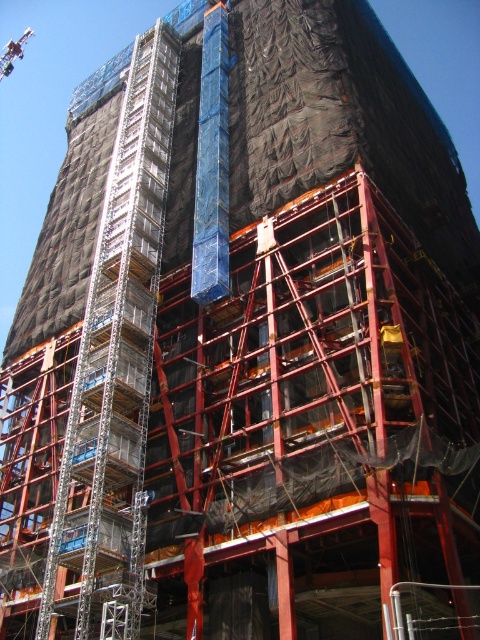
Question: Does metallic scaffolding at left appear on the right side of metallic red crane at upper left?

Choices:
 (A) yes
 (B) no

Answer: (A)

Question: Does metallic scaffolding at left appear on the right side of metallic red crane at upper left?

Choices:
 (A) yes
 (B) no

Answer: (A)

Question: Among these points, which one is farthest from the camera?

Choices:
 (A) (20, 44)
 (B) (148, 340)

Answer: (A)

Question: Can you confirm if metallic scaffolding at left is positioned below metallic red crane at upper left?

Choices:
 (A) no
 (B) yes

Answer: (B)

Question: Which point appears farthest from the camera in this image?

Choices:
 (A) (33, 32)
 (B) (152, 148)

Answer: (A)